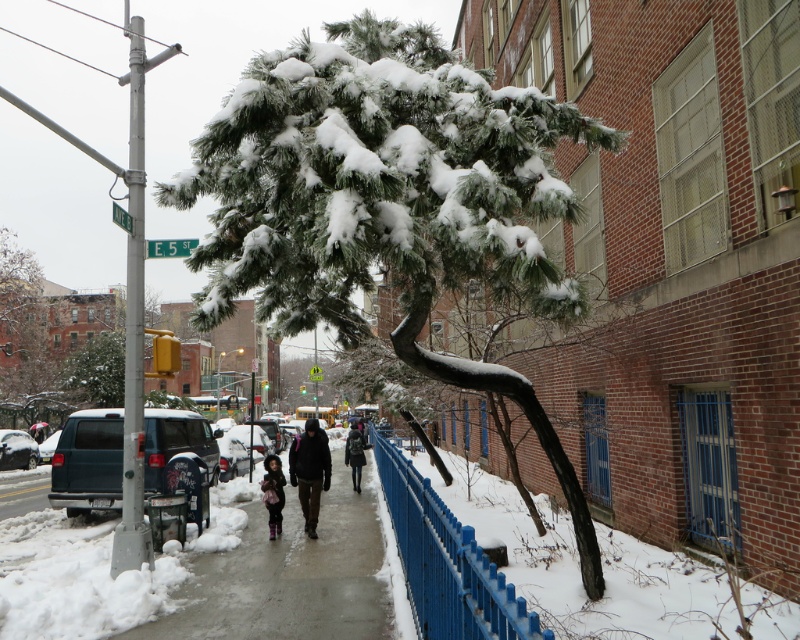
You are standing on the snowy sidewalk and want to hand a leaflet to the person wearing the dark brown leather jacket at center. Based on their position, where should you approach them from?

The dark brown leather jacket at center is located at point (310, 470), which suggests the person is positioned slightly to the right and forward in the scene. You should approach from the left side to ensure you are within their line of sight and avoid obstructing their path on the partially cleared sidewalk.

You are standing at the point marked as point [388,200] in the image. What object are you facing?

The point [388,200] corresponds to the green snow covered tree at center, so you are facing the green snow covered tree at center.